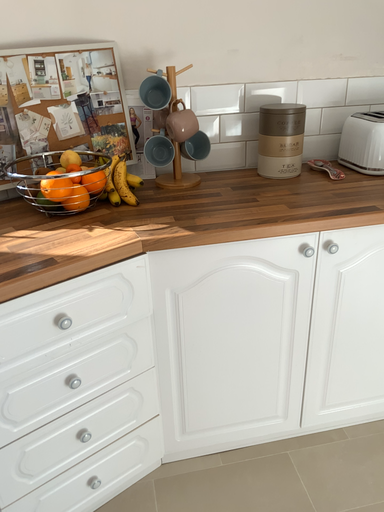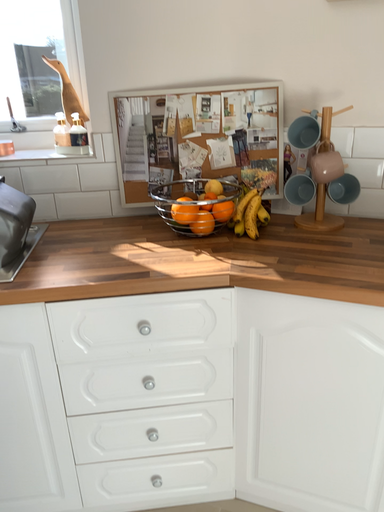
Question: Which way did the camera rotate in the video?

Choices:
 (A) rotated left
 (B) rotated right

Answer: (A)